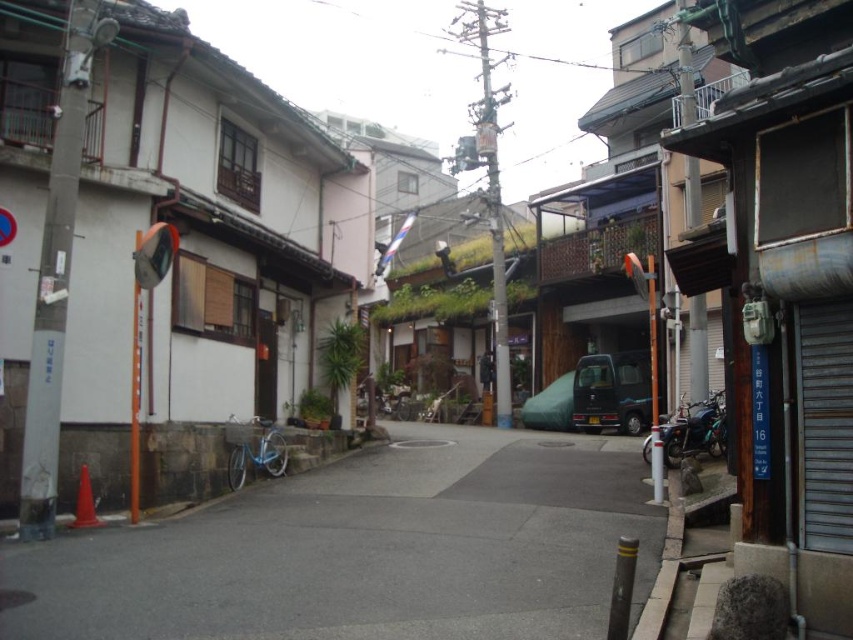
Question: Does smooth concrete sidewalk at center have a greater width compared to green fabric van at center?

Choices:
 (A) no
 (B) yes

Answer: (B)

Question: Does smooth concrete sidewalk at center have a lesser width compared to green fabric van at center?

Choices:
 (A) yes
 (B) no

Answer: (B)

Question: Which point appears closest to the camera in this image?

Choices:
 (A) (553, 397)
 (B) (465, 516)

Answer: (B)

Question: Which point is closer to the camera taking this photo?

Choices:
 (A) (91, 540)
 (B) (537, 404)

Answer: (A)

Question: Is smooth concrete sidewalk at center above green fabric van at center?

Choices:
 (A) yes
 (B) no

Answer: (B)